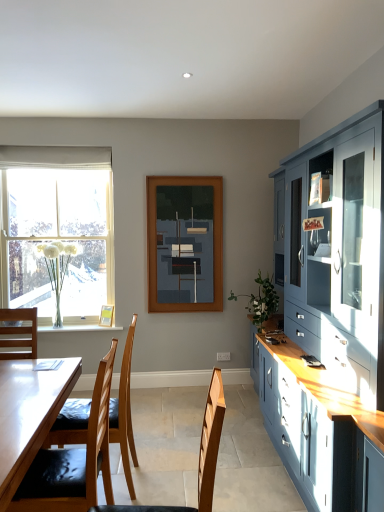
In order to click on free spot above white sheer curtain at upper left (from a real-world perspective) in this screenshot , I will do coord(48,146).